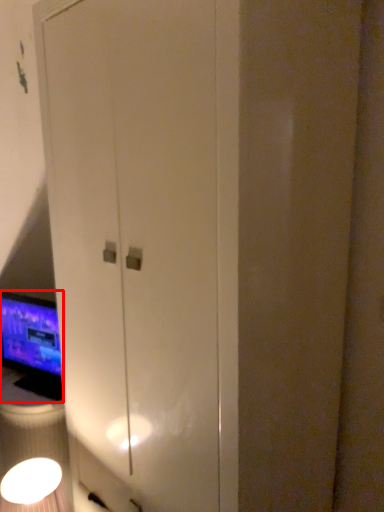
Question: In this image, where is computer monitor (annotated by the red box) located relative to light fixture?

Choices:
 (A) left
 (B) right

Answer: (A)